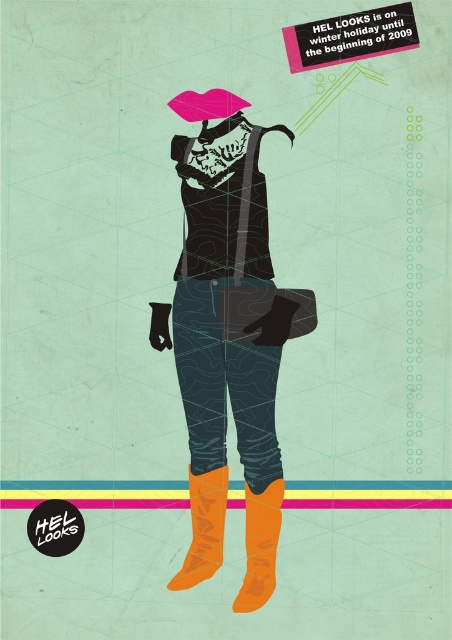
What do you see at coordinates (230, 348) in the screenshot? I see `matte black vest at center` at bounding box center [230, 348].

Which is behind, point (206, 285) or point (248, 102)?

Positioned behind is point (248, 102).

Is point (194, 515) positioned after point (186, 100)?

No, it is in front of (186, 100).

Identify the location of matte black vest at center. Image resolution: width=452 pixels, height=640 pixels. (230, 348).

Who is positioned more to the right, matte black vest at center or orange suede boot at lower right?

Positioned to the right is orange suede boot at lower right.

Can you confirm if matte black vest at center is shorter than orange suede boot at lower right?

No.

You are a GUI agent. You are given a task and a screenshot of the screen. Output one action in this format:
    pyautogui.click(x=<x>, y=<y>)
    Task: Click on the matte black vest at center
    
    Given the screenshot: What is the action you would take?
    pyautogui.click(x=230, y=348)

Is orange matte boot at lower center above pink matte umbrella at upper center?

Actually, orange matte boot at lower center is below pink matte umbrella at upper center.

Is point (216, 472) positioned after point (248, 100)?

That is False.

You are a GUI agent. You are given a task and a screenshot of the screen. Output one action in this format:
    pyautogui.click(x=<x>, y=<y>)
    Task: Click on the orange matte boot at lower center
    This screenshot has height=640, width=452.
    Given the screenshot: What is the action you would take?
    pyautogui.click(x=203, y=529)